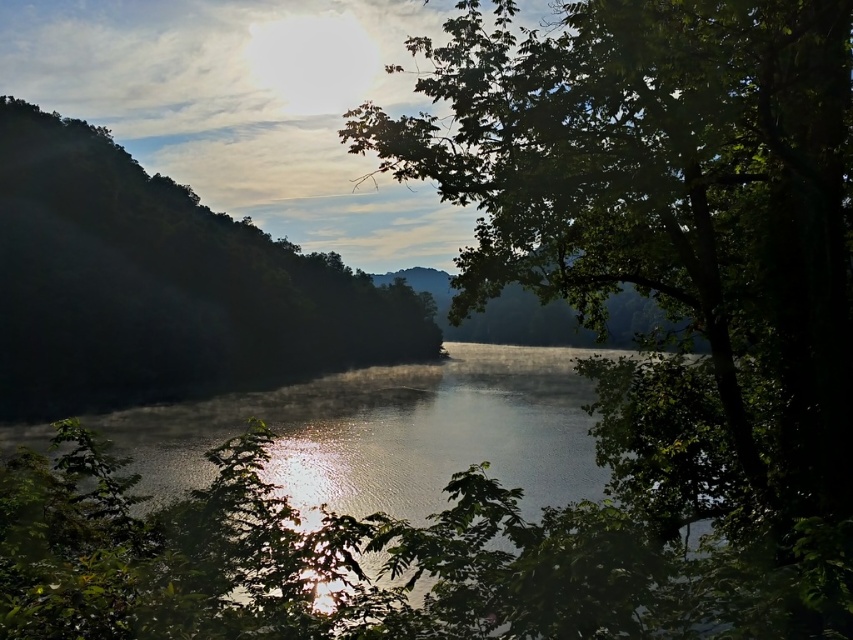
Who is shorter, green leafy tree at center or glistening water at center?

glistening water at center

Locate an element on the screen. green leafy tree at center is located at coordinates (666, 227).

Is green leafy tree at left bigger than glistening water at center?

Yes, green leafy tree at left is bigger than glistening water at center.

Who is more distant from viewer, (x=201, y=348) or (x=512, y=476)?

Point (x=201, y=348)

Locate an element on the screen. green leafy tree at left is located at coordinates (161, 285).

Is green leafy tree at center shorter than green leafy tree at left?

Indeed, green leafy tree at center has a lesser height compared to green leafy tree at left.

The width and height of the screenshot is (853, 640). What do you see at coordinates (666, 227) in the screenshot?
I see `green leafy tree at center` at bounding box center [666, 227].

Is point (531, 45) more distant than point (169, 346)?

No.

I want to click on green leafy tree at center, so click(666, 227).